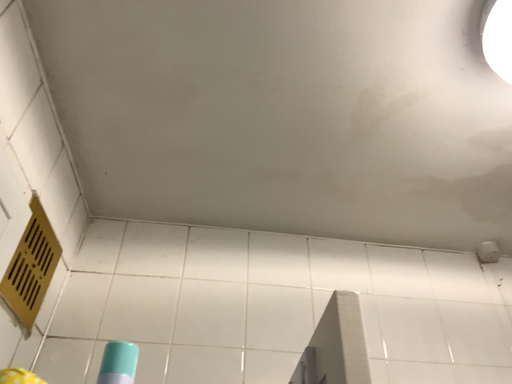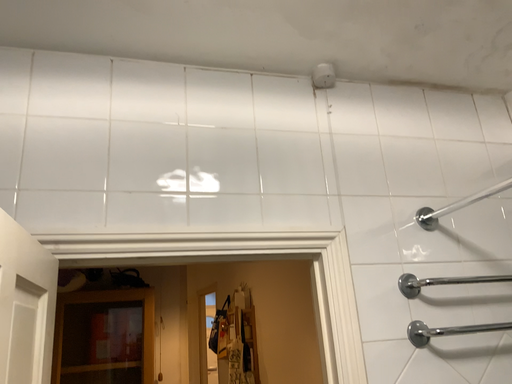
Question: How did the camera likely rotate when shooting the video?

Choices:
 (A) rotated downward
 (B) rotated upward

Answer: (A)